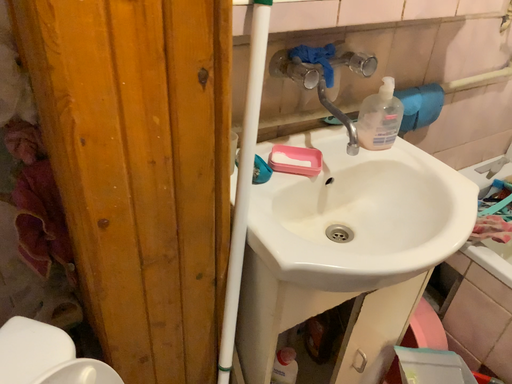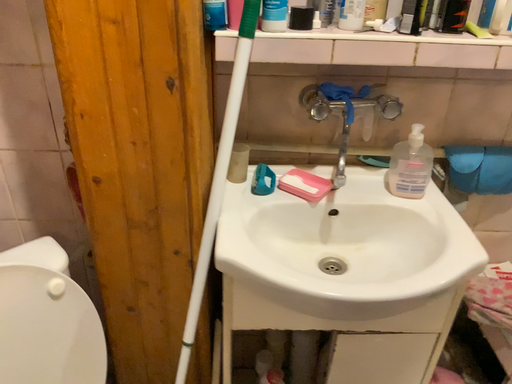
Question: Which way did the camera rotate in the video?

Choices:
 (A) rotated right
 (B) rotated left

Answer: (B)